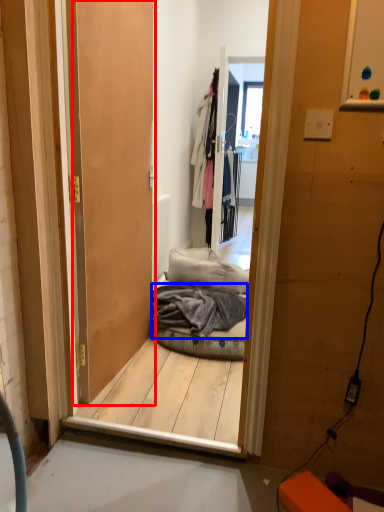
Question: Which object appears closest to the camera in this image, door (highlighted by a red box) or material (highlighted by a blue box)?

Choices:
 (A) door
 (B) material

Answer: (A)